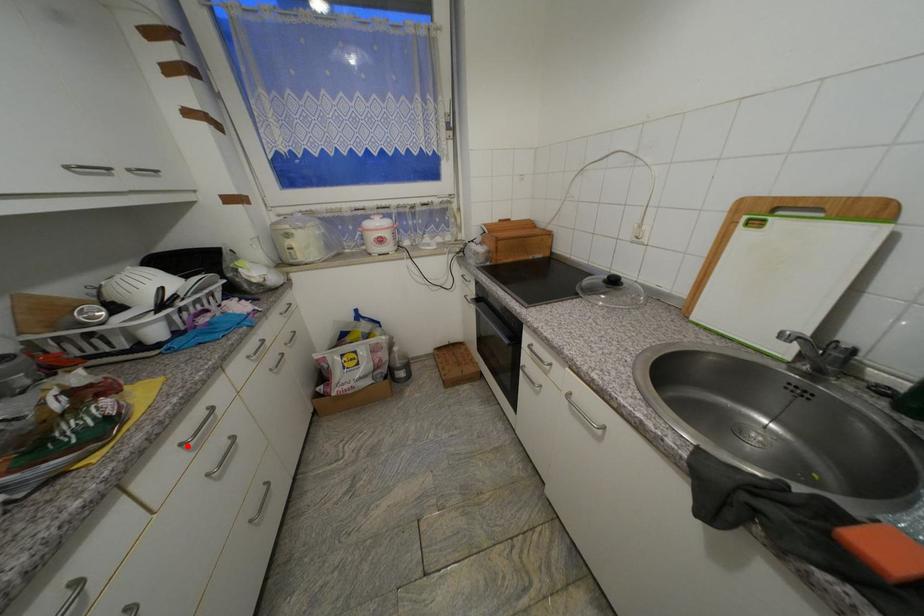
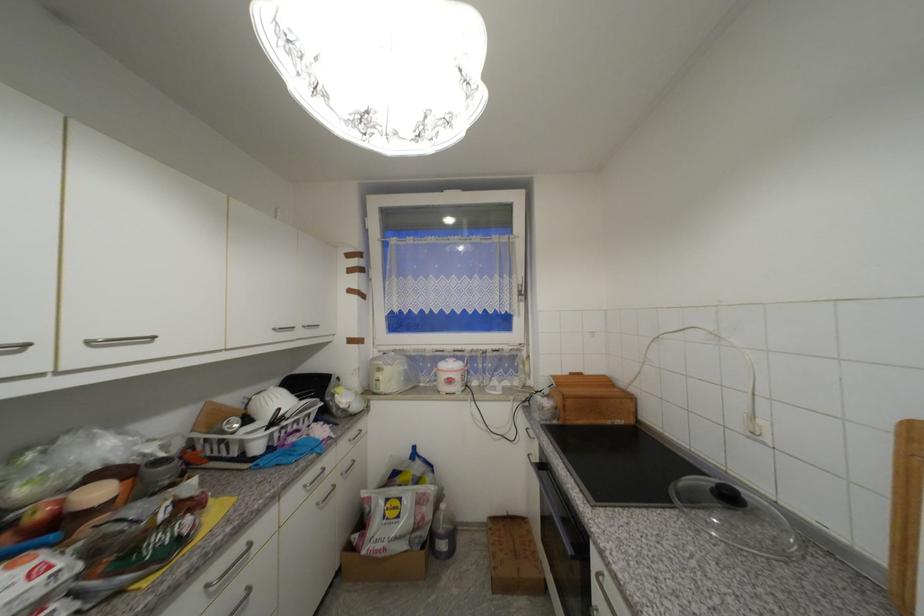
Where in the second image is the point corresponding to the highlighted location from the first image?

(213, 588)